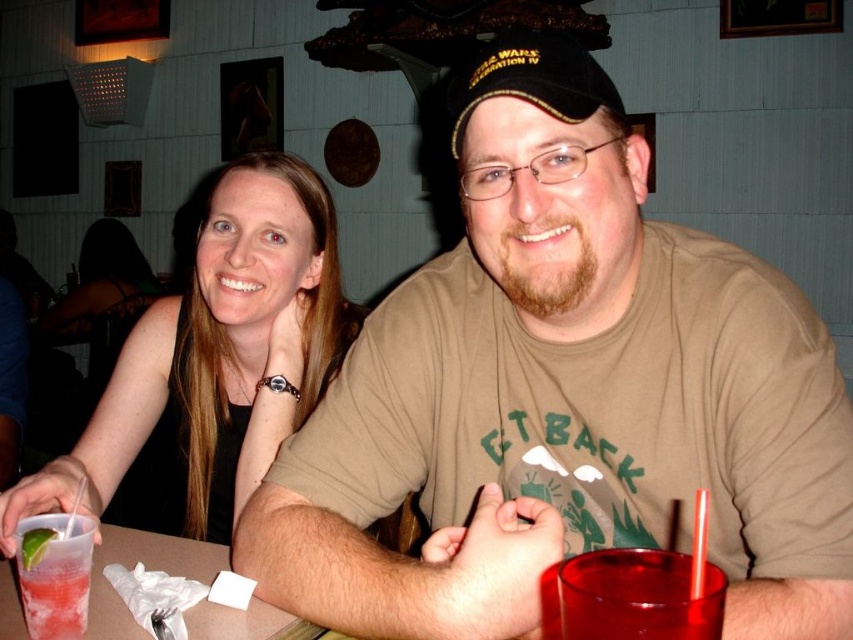
Question: Does transparent plastic cup at lower right appear on the left side of clear plastic cup at lower left?

Choices:
 (A) yes
 (B) no

Answer: (B)

Question: Is smooth black tank top at upper left below green lime at lower left?

Choices:
 (A) yes
 (B) no

Answer: (A)

Question: Which point appears farthest from the camera in this image?

Choices:
 (A) (538, 550)
 (B) (569, 577)
 (C) (70, 620)
 (D) (33, 548)

Answer: (C)

Question: Does smooth black tank top at upper left appear on the right side of clear plastic cup at lower left?

Choices:
 (A) no
 (B) yes

Answer: (A)

Question: Which point appears closest to the camera in this image?

Choices:
 (A) (149, 442)
 (B) (141, 632)

Answer: (B)

Question: Which of these objects is positioned closest to the green lime at lower left?

Choices:
 (A) translucent plastic cup at lower left
 (B) clear plastic cup at lower left
 (C) matte brown t-shirt at center

Answer: (A)